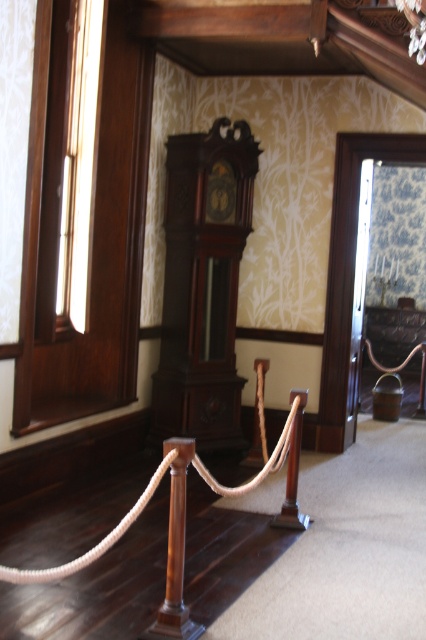
You are standing in the historic room and want to determine the relative depth of two points marked in the image. Which point is closer to you, point (215, 234) or point (209, 476)?

Point (215, 234) is closer to you than point (209, 476) because it is further to the viewer according to the description.

You are standing in the historic room and want to place a small decorative item exactly at the center of the room. Given the dark wood grandfather clock at center is located at point 0.445, 0.477, is this the correct spot to place the item?

The dark wood grandfather clock at center is located at point (203, 284), so placing the item there would mean it is at the center of the room.

You are a visitor in this historic room and notice the dark wood grandfather clock at center and the brown rope at center. Which object is closer to the right wall?

The dark wood grandfather clock at center is positioned on the right side of brown rope at center, so it is closer to the right wall than the brown rope at center.